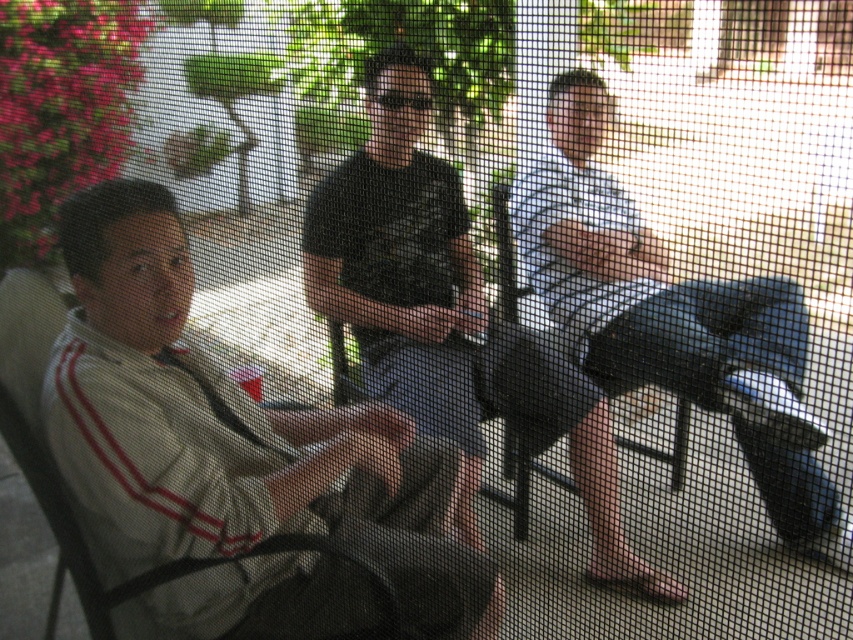
Question: Is the position of black matte shirt at center less distant than that of black plastic chair at center?

Choices:
 (A) no
 (B) yes

Answer: (B)

Question: Which object is positioned closest to the light blue striped shirt at right?

Choices:
 (A) black plastic chair at center
 (B) black matte shirt at center

Answer: (B)

Question: Which point is closer to the camera?

Choices:
 (A) black matte shirt at center
 (B) light blue striped shirt at right
 (C) black plastic chair at center

Answer: (A)

Question: Does light blue striped shirt at right appear on the left side of black plastic chair at center?

Choices:
 (A) no
 (B) yes

Answer: (A)

Question: From the image, what is the correct spatial relationship of white fabric jacket at left in relation to black matte shirt at center?

Choices:
 (A) below
 (B) above

Answer: (A)

Question: Which of the following is the farthest from the observer?

Choices:
 (A) (152, 545)
 (B) (358, 173)
 (C) (518, 528)
 (D) (787, 445)

Answer: (C)